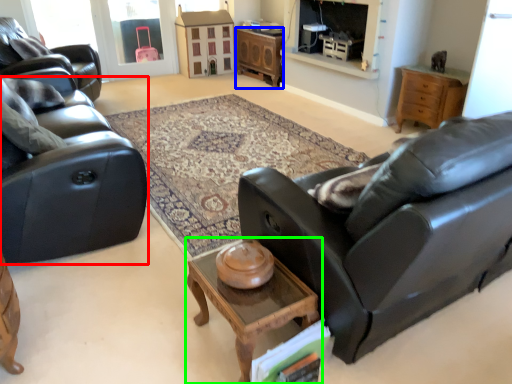
Question: Which object is positioned farthest from studio couch (highlighted by a red box)? Select from desk (highlighted by a blue box) and coffee table (highlighted by a green box).

Choices:
 (A) desk
 (B) coffee table

Answer: (A)